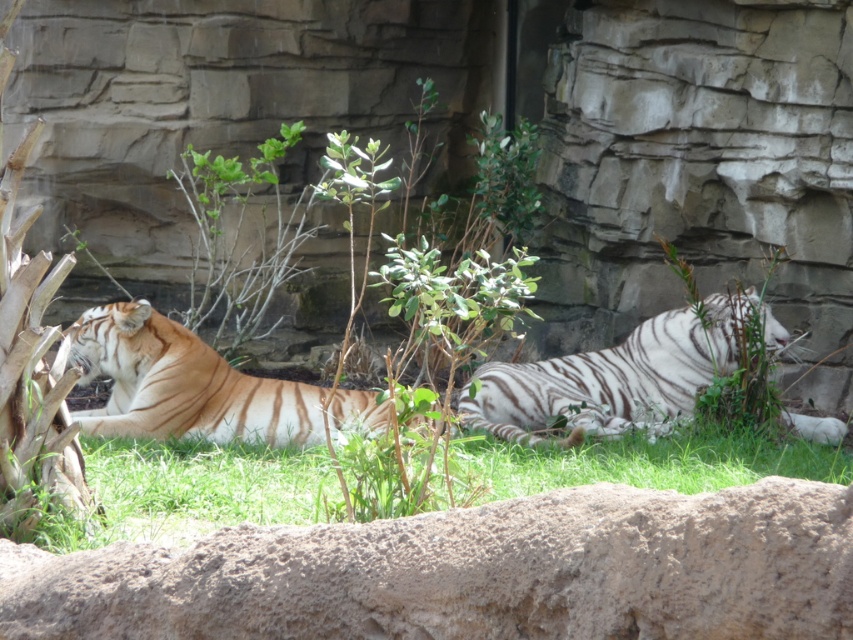
You are a zookeeper observing the tigers in their enclosure. You notice the orange fur tiger at left and the white striped tiger at center. Which tiger is closer to the entrance of the enclosure?

The orange fur tiger at left is closer to the entrance of the enclosure because it is positioned in front of the white striped tiger at center, indicating it is nearer to the observer.

You are a zookeeper observing the enclosure. You notice the orange fur tiger at left and the green grass at center. Which object is located below the other?

The green grass at center is positioned under the orange fur tiger at left, so the grass is below the tiger.

You are a zookeeper who needs to distribute food to the orange fur tiger at left and the green grass at center. If you have a limited amount of food, which one should you prioritize feeding first?

The orange fur tiger at left should be prioritized because the green grass at center is smaller and may not require as much food.